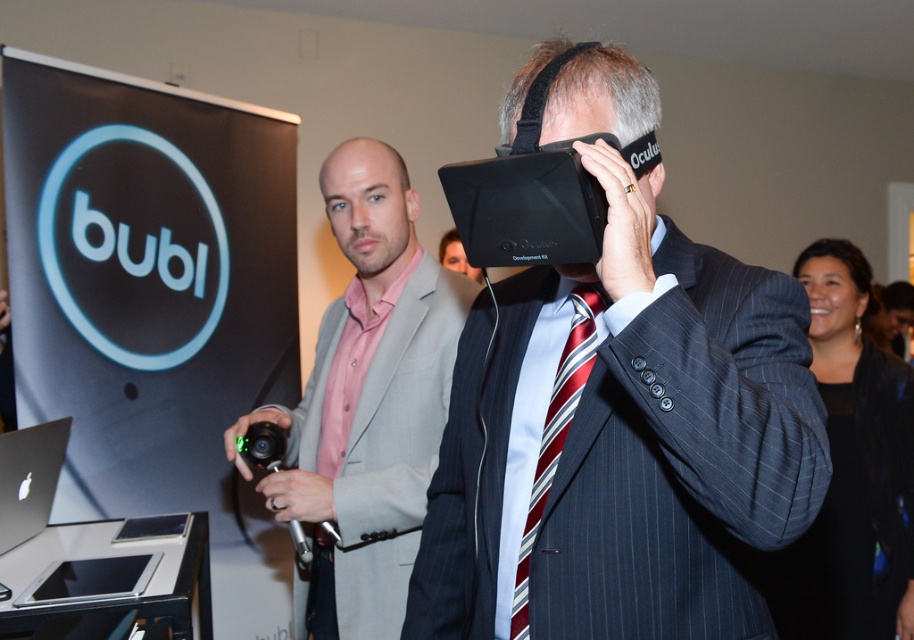
Question: Can you confirm if matte black vr headset at center is positioned below black matte laptop at lower left?

Choices:
 (A) yes
 (B) no

Answer: (B)

Question: Which object is the farthest from the black matte laptop at lower left?

Choices:
 (A) striped silk tie at center
 (B) matte black vr headset at center
 (C) pink satin shirt at center

Answer: (A)

Question: Estimate the real-world distances between objects in this image. Which object is farther from the matte black vr headset at center?

Choices:
 (A) striped silk tie at center
 (B) black matte laptop at lower left
 (C) pink satin shirt at center

Answer: (B)

Question: Which point appears closest to the camera in this image?

Choices:
 (A) [796, 321]
 (B) [570, 406]

Answer: (A)

Question: Does matte black vr headset at center lie in front of striped silk tie at center?

Choices:
 (A) no
 (B) yes

Answer: (B)

Question: Considering the relative positions of pink satin shirt at center and striped silk tie at center in the image provided, where is pink satin shirt at center located with respect to striped silk tie at center?

Choices:
 (A) above
 (B) below

Answer: (A)